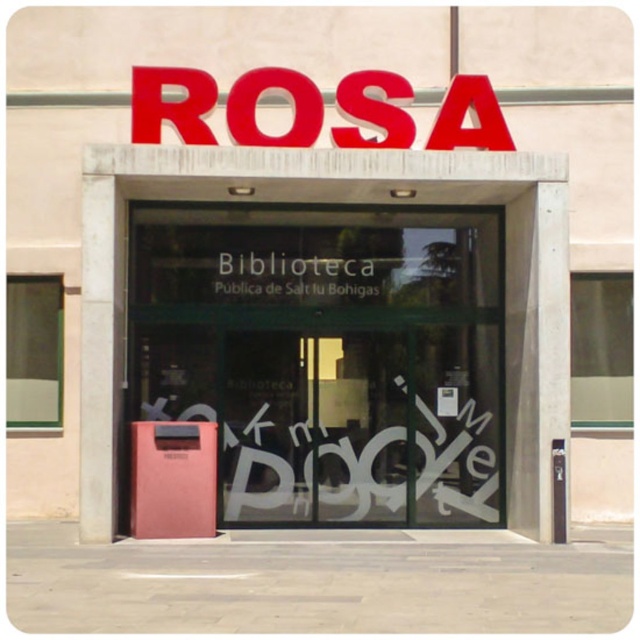
Question: Can you confirm if pink matte trash can at center is positioned to the left of black glass sign at center?

Choices:
 (A) yes
 (B) no

Answer: (B)

Question: Can you confirm if pink matte trash can at center is wider than black glass sign at center?

Choices:
 (A) yes
 (B) no

Answer: (A)

Question: Is pink matte trash can at center positioned in front of black glass sign at center?

Choices:
 (A) yes
 (B) no

Answer: (A)

Question: Which object appears farthest from the camera in this image?

Choices:
 (A) black glass sign at center
 (B) pink matte trash can at center

Answer: (A)

Question: Which of the following is the farthest from the observer?

Choices:
 (A) black glass sign at center
 (B) pink matte trash can at center

Answer: (A)